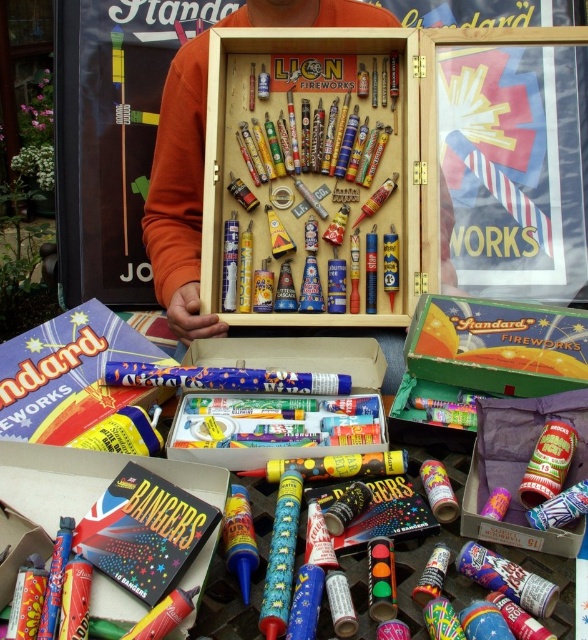
Question: Among these points, which one is farthest from the camera?

Choices:
 (A) pos(162,476)
 (B) pos(172,248)
 (C) pos(516,349)
 (D) pos(519,438)

Answer: (B)

Question: Is orange cotton shirt at center to the right of green cardboard box at center from the viewer's perspective?

Choices:
 (A) yes
 (B) no

Answer: (B)

Question: Is orange cotton shirt at center above metallic silver canister at center?

Choices:
 (A) yes
 (B) no

Answer: (A)

Question: Where is orange cotton shirt at center located in relation to matte cardboard box of bangers at center in the image?

Choices:
 (A) above
 (B) below

Answer: (A)

Question: Among these objects, which one is nearest to the camera?

Choices:
 (A) matte cardboard box at lower left
 (B) metallic silver canister at center

Answer: (B)

Question: Which point is closer to the camera?

Choices:
 (A) (61, 436)
 (B) (32, 522)
 (C) (360, 19)
 (D) (564, 538)

Answer: (B)